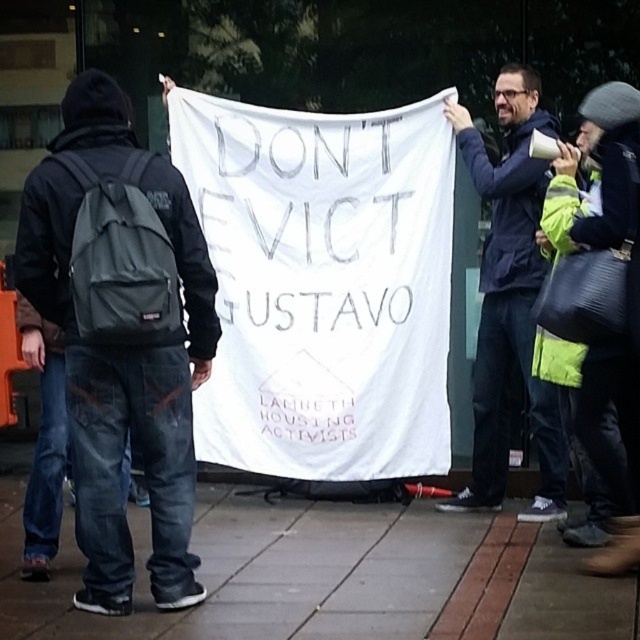
Who is more distant from viewer, (196, 132) or (516, 132)?

The point (196, 132) is more distant.

Does point (413, 141) come farther from viewer compared to point (516, 230)?

That is True.

Which is in front, point (442, 115) or point (525, 140)?

Point (525, 140)

In order to click on white fabric banner at center in this screenshot , I will do `click(323, 285)`.

Based on the photo, who is positioned more to the left, dark blue jacket at center or green reflective jacket at upper right?

From the viewer's perspective, dark blue jacket at center appears more on the left side.

I want to click on dark blue jacket at center, so click(509, 298).

Is point (72, 372) in front of point (586, 214)?

Yes, it is.

Does point (166, 300) come behind point (637, 406)?

No, (166, 300) is in front of (637, 406).

This screenshot has height=640, width=640. I want to click on dark gray backpack at center, so click(122, 333).